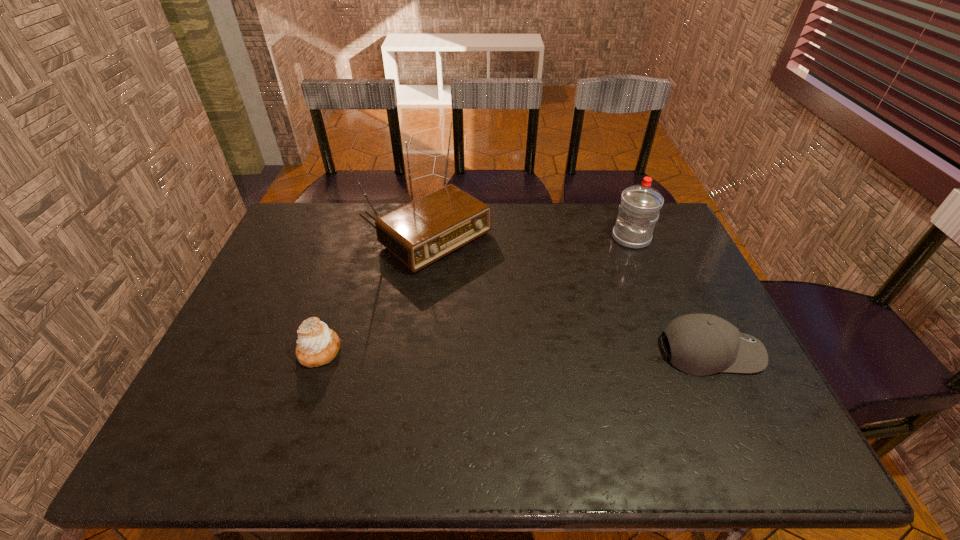
The height and width of the screenshot is (540, 960). I want to click on the shortest object, so click(x=317, y=345).

Identify the location of the third tallest object. The height and width of the screenshot is (540, 960). (701, 344).

Where is `the second tallest object`? The width and height of the screenshot is (960, 540). the second tallest object is located at coordinates (640, 205).

Locate an element on the screen. This screenshot has width=960, height=540. radio_receiver is located at coordinates (419, 233).

You are a GUI agent. You are given a task and a screenshot of the screen. Output one action in this format:
    pyautogui.click(x=<x>, y=<y>)
    Task: Click on the vacant space situated 0.320m on the back of the shortest object
    
    Given the screenshot: What is the action you would take?
    point(351,255)

Identify the location of free space located on the handle side of the second tallest object. (597, 265).

Locate an element on the screen. free space located 0.370m on the handle side of the second tallest object is located at coordinates (547, 305).

Identify the location of vacant space situated 0.200m on the handle side of the second tallest object. The height and width of the screenshot is (540, 960). (584, 276).

Where is `free point located on the front panel of the tallest object`? The image size is (960, 540). free point located on the front panel of the tallest object is located at coordinates (533, 314).

Identify the location of vacant space located 0.400m on the front panel of the tallest object. The width and height of the screenshot is (960, 540). (570, 342).